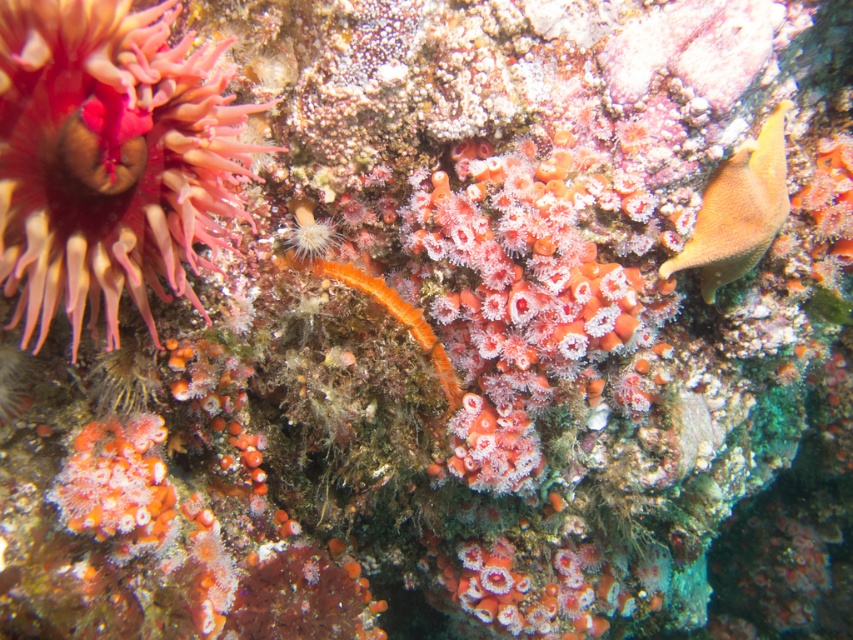
Question: Which of the following is the farthest from the observer?

Choices:
 (A) (65, 268)
 (B) (775, 225)

Answer: (B)

Question: Can you confirm if matte pink coral at upper left is positioned above smooth orange fish at right?

Choices:
 (A) yes
 (B) no

Answer: (B)

Question: Where is matte pink coral at upper left located in relation to smooth orange fish at right in the image?

Choices:
 (A) above
 (B) below

Answer: (B)

Question: Which point appears farthest from the camera in this image?

Choices:
 (A) (6, 285)
 (B) (706, 237)

Answer: (B)

Question: Does matte pink coral at upper left lie in front of smooth orange fish at right?

Choices:
 (A) no
 (B) yes

Answer: (B)

Question: Which point is closer to the camera?

Choices:
 (A) (82, 102)
 (B) (784, 177)

Answer: (A)